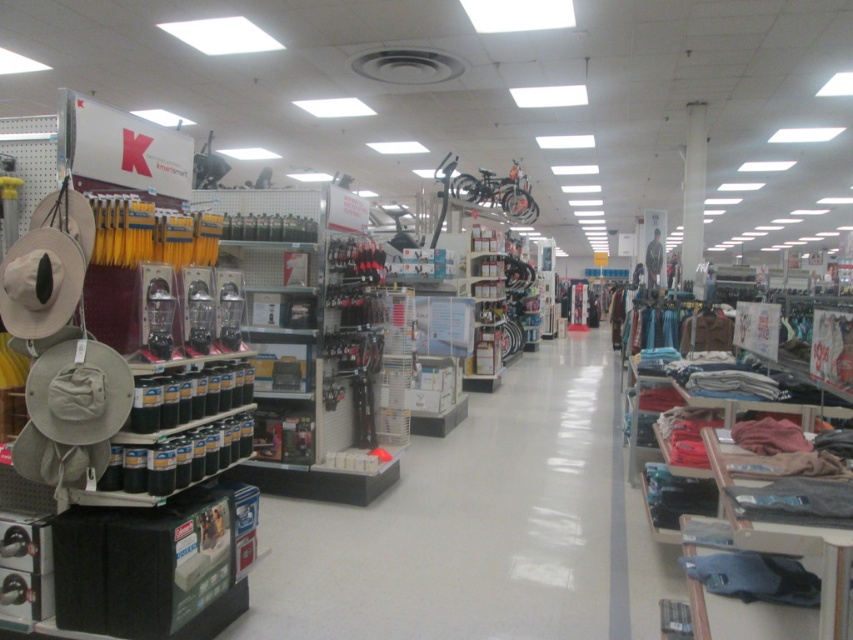
Question: Which object is farther from the camera taking this photo?

Choices:
 (A) camouflage fabric shirt at center
 (B) denim fabric pants at lower right

Answer: (A)

Question: Which object appears closest to the camera in this image?

Choices:
 (A) denim fabric pants at lower right
 (B) camouflage fabric shirt at center

Answer: (A)

Question: Can you confirm if denim fabric pants at lower right is positioned below camouflage fabric shirt at center?

Choices:
 (A) yes
 (B) no

Answer: (A)

Question: Is denim fabric pants at lower right below camouflage fabric shirt at center?

Choices:
 (A) yes
 (B) no

Answer: (A)

Question: Does denim fabric pants at lower right appear on the left side of camouflage fabric shirt at center?

Choices:
 (A) yes
 (B) no

Answer: (A)